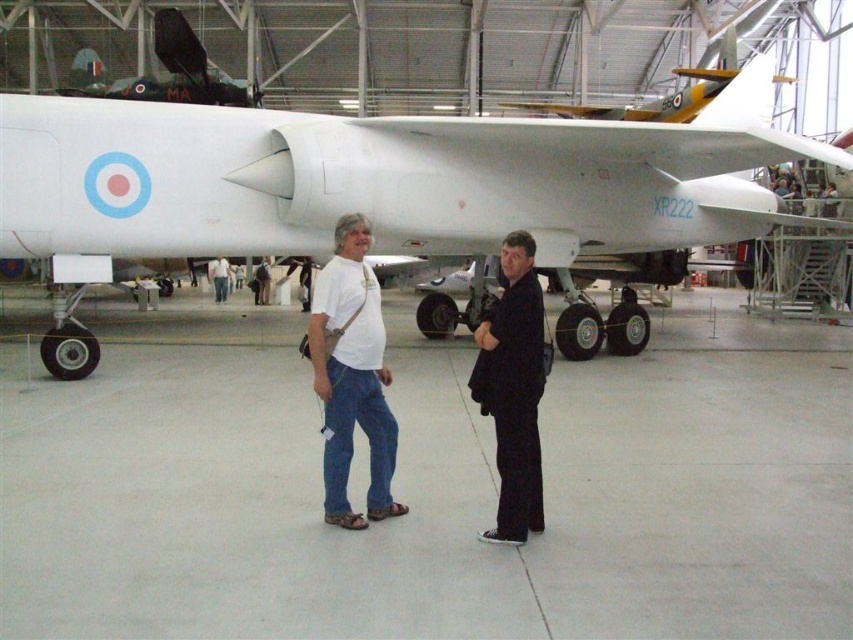
Find the location of a particular element. white cotton t-shirt at center is located at coordinates (351, 376).

Which is more to the left, white cotton t-shirt at center or black matte suit at center?

white cotton t-shirt at center

Between point (352, 220) and point (497, 410), which one is positioned in front?

Point (497, 410)

Find the location of a particular element. white cotton t-shirt at center is located at coordinates (351, 376).

Can you confirm if white matte airplane at center is bigger than black matte suit at center?

Correct, white matte airplane at center is larger in size than black matte suit at center.

Between white matte airplane at center and black matte suit at center, which one has less height?

Standing shorter between the two is black matte suit at center.

At what (x,y) coordinates should I click in order to perform the action: click on white matte airplane at center. Please return your answer as a coordinate pair (x, y). Looking at the image, I should click on (376, 186).

Is white matte airplane at center positioned behind white cotton t-shirt at center?

Yes, white matte airplane at center is behind white cotton t-shirt at center.

Does white matte airplane at center have a larger size compared to white cotton t-shirt at center?

Correct, white matte airplane at center is larger in size than white cotton t-shirt at center.

Who is more distant from viewer, (500,141) or (369,381)?

Point (500,141)

The width and height of the screenshot is (853, 640). I want to click on white matte airplane at center, so click(x=376, y=186).